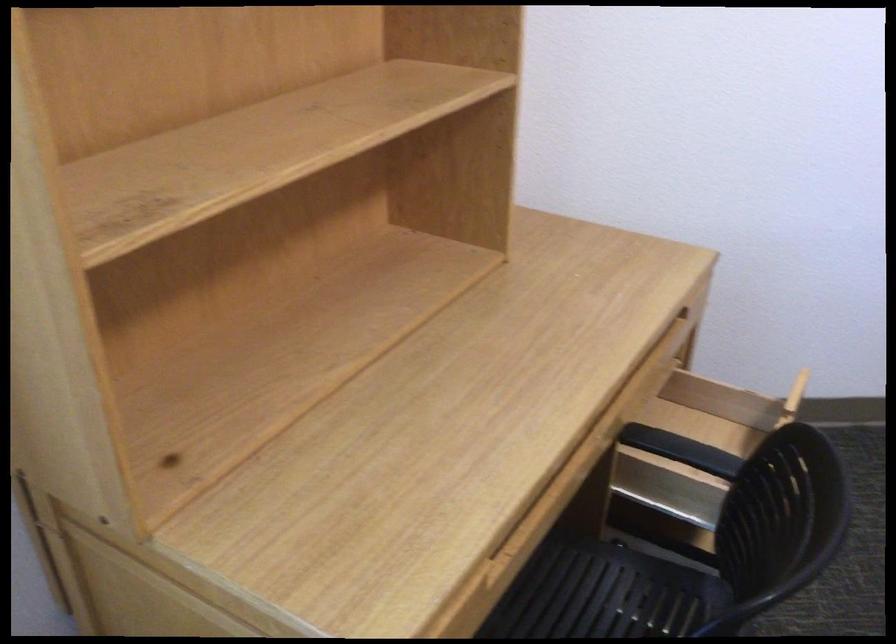
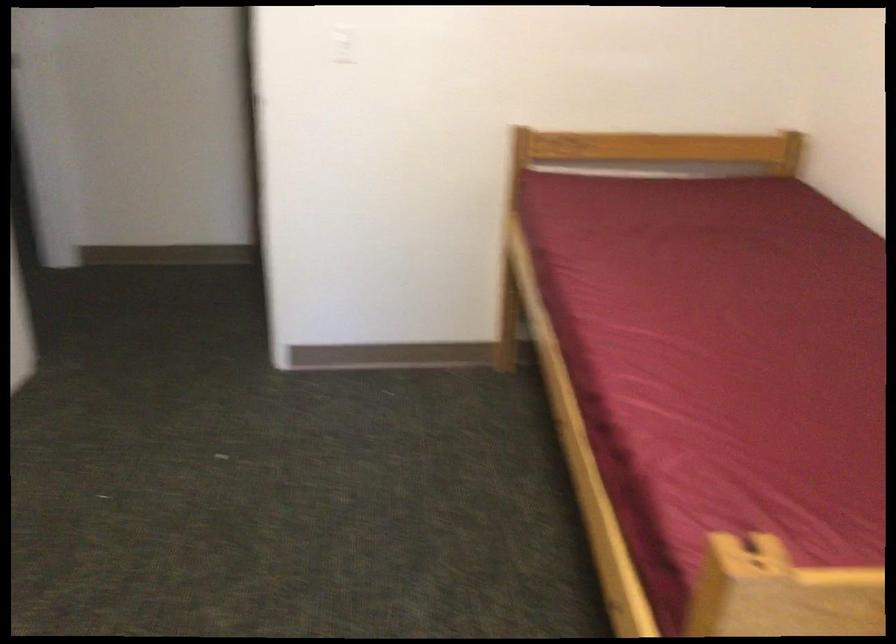
The images are taken continuously from a first-person perspective. In which direction is your viewpoint rotating?

The rotation direction of the camera is right-down.